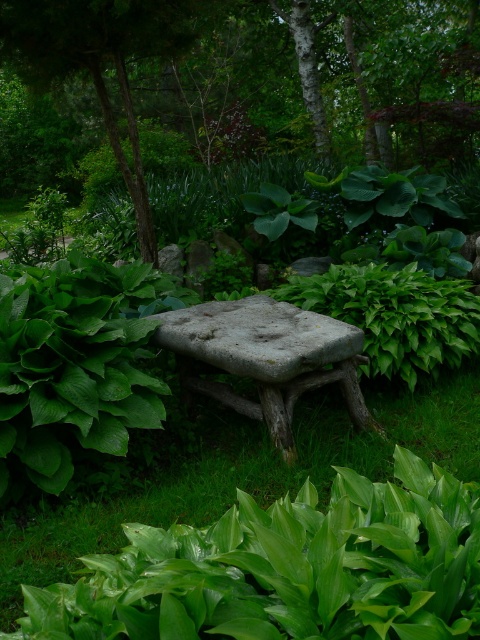
Question: Which object is the farthest from the green grass at center?

Choices:
 (A) rough stone bench at center
 (B) green leafy tree at center

Answer: (B)

Question: From the image, what is the correct spatial relationship of green grass at center in relation to rough stone bench at center?

Choices:
 (A) below
 (B) above

Answer: (A)

Question: Is the position of green leafy tree at center more distant than that of green grass at center?

Choices:
 (A) yes
 (B) no

Answer: (A)

Question: Which object is farther from the camera taking this photo?

Choices:
 (A) green leafy tree at center
 (B) rough stone bench at center
 (C) green grass at center

Answer: (A)

Question: Which point is closer to the camera taking this photo?

Choices:
 (A) (95, 538)
 (B) (264, 336)
 (C) (176, 74)

Answer: (A)

Question: Can you confirm if green leafy tree at center is positioned above green grass at center?

Choices:
 (A) no
 (B) yes

Answer: (B)